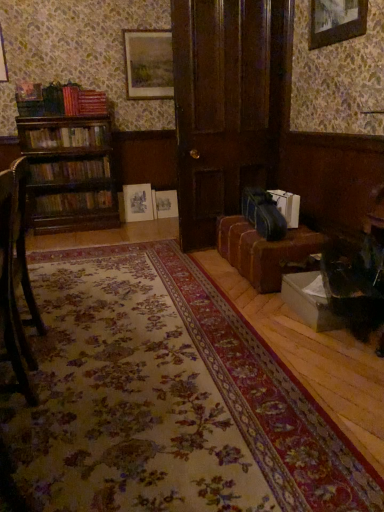
Find the location of `free point above matte wooden picture frame at upper center, the 1th picture frame when ordered from left to right (from a real-world perspective)`. free point above matte wooden picture frame at upper center, the 1th picture frame when ordered from left to right (from a real-world perspective) is located at coordinates (154, 26).